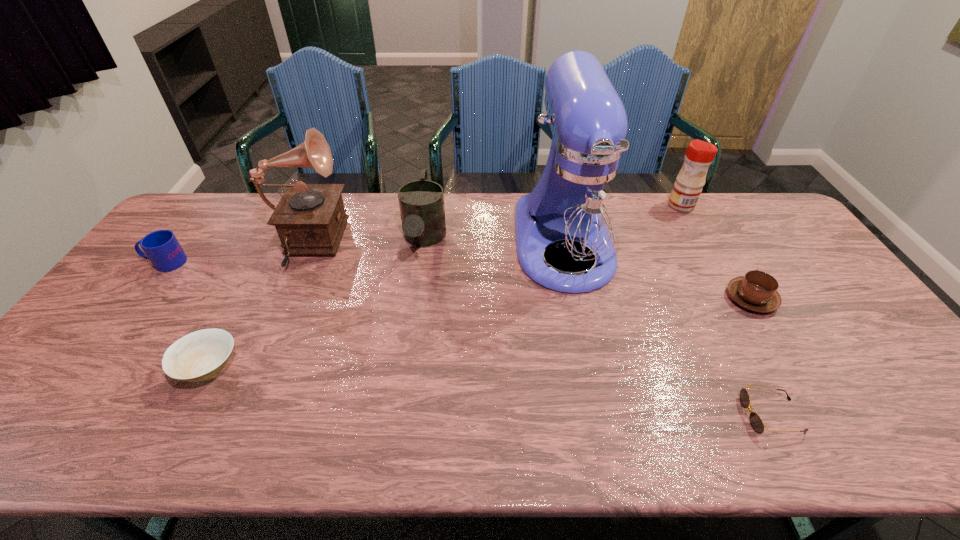
Where is `mixer`? mixer is located at coordinates (578, 206).

The height and width of the screenshot is (540, 960). Find the location of `the fifth object from left to right`. the fifth object from left to right is located at coordinates [578, 206].

Locate an element on the screen. Image resolution: width=960 pixels, height=540 pixels. record player is located at coordinates (310, 219).

This screenshot has width=960, height=540. Identify the location of the sixth shortest object. (687, 188).

Identify the location of the fifth object from right to left. (421, 202).

This screenshot has width=960, height=540. Find the location of `watering can`. watering can is located at coordinates (421, 202).

The height and width of the screenshot is (540, 960). Identify the location of the fifth tallest object. (161, 247).

Locate an element on the screen. mug is located at coordinates (161, 247).

The height and width of the screenshot is (540, 960). Identify the location of cappuccino. (757, 291).

At what (x,y) coordinates should I click in order to perform the action: click on bowl. Please return your answer as a coordinate pair (x, y). The width and height of the screenshot is (960, 540). Looking at the image, I should click on point(200,355).